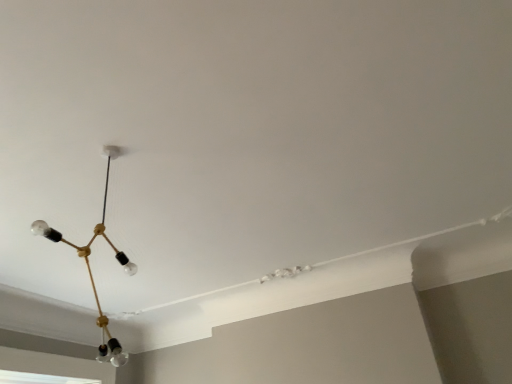
This screenshot has height=384, width=512. Describe the element at coordinates (90, 268) in the screenshot. I see `gold metallic chandelier at upper left` at that location.

At what (x,y) coordinates should I click in order to perform the action: click on gold metallic chandelier at upper left. Please return your answer as a coordinate pair (x, y). This screenshot has width=512, height=384. Looking at the image, I should click on 90,268.

What do you see at coordinates (40, 378) in the screenshot? The width and height of the screenshot is (512, 384). I see `transparent glass window at lower left` at bounding box center [40, 378].

You are a GUI agent. You are given a task and a screenshot of the screen. Output one action in this format:
    pyautogui.click(x=<x>, y=<y>)
    Task: Click on the transparent glass window at lower left
    
    Given the screenshot: What is the action you would take?
    coord(40,378)

Where is `gold metallic chandelier at upper left`? This screenshot has height=384, width=512. gold metallic chandelier at upper left is located at coordinates (90, 268).

Is transparent glass window at lower left to the left or to the right of gold metallic chandelier at upper left in the image?

In the image, transparent glass window at lower left appears on the left side of gold metallic chandelier at upper left.

Considering the positions of objects transparent glass window at lower left and gold metallic chandelier at upper left in the image provided, who is behind, transparent glass window at lower left or gold metallic chandelier at upper left?

transparent glass window at lower left is behind.

Which is closer, [81,383] or [83,252]?

The point [83,252] is in front.

From the image's perspective, is transparent glass window at lower left above or below gold metallic chandelier at upper left?

transparent glass window at lower left is below gold metallic chandelier at upper left.

From a real-world perspective, does transparent glass window at lower left stand above gold metallic chandelier at upper left?

No, from a real-world perspective, transparent glass window at lower left is not above gold metallic chandelier at upper left.

Looking at this image, looking at their sizes, would you say transparent glass window at lower left is wider or thinner than gold metallic chandelier at upper left?

Clearly, transparent glass window at lower left has less width compared to gold metallic chandelier at upper left.

Does transparent glass window at lower left have a greater height compared to gold metallic chandelier at upper left?

No, transparent glass window at lower left is not taller than gold metallic chandelier at upper left.

Which of these two, transparent glass window at lower left or gold metallic chandelier at upper left, is smaller?

With smaller size is transparent glass window at lower left.

Would you say transparent glass window at lower left contains gold metallic chandelier at upper left?

No, transparent glass window at lower left does not contain gold metallic chandelier at upper left.

Are transparent glass window at lower left and gold metallic chandelier at upper left far apart?

Yes, transparent glass window at lower left and gold metallic chandelier at upper left are located far from each other.

Is gold metallic chandelier at upper left at the back of transparent glass window at lower left?

No.

How many degrees apart are the facing directions of transparent glass window at lower left and gold metallic chandelier at upper left?

The angle between the facing direction of transparent glass window at lower left and the facing direction of gold metallic chandelier at upper left is 88.1 degrees.

You are a GUI agent. You are given a task and a screenshot of the screen. Output one action in this format:
    pyautogui.click(x=<x>, y=<y>)
    Task: Click on the lamp in front of the transparent glass window at lower left
    The height and width of the screenshot is (384, 512).
    Given the screenshot: What is the action you would take?
    pyautogui.click(x=90, y=268)

Between gold metallic chandelier at upper left and transparent glass window at lower left, which one appears on the left side from the viewer's perspective?

From the viewer's perspective, transparent glass window at lower left appears more on the left side.

Is gold metallic chandelier at upper left positioned before transparent glass window at lower left?

That is True.

Is point (134, 274) behind point (85, 378)?

No, it is not.

From the image's perspective, is gold metallic chandelier at upper left located above or below transparent glass window at lower left?

Based on their image positions, gold metallic chandelier at upper left is located above transparent glass window at lower left.

From a real-world perspective, who is located lower, gold metallic chandelier at upper left or transparent glass window at lower left?

transparent glass window at lower left, from a real-world perspective.

Is gold metallic chandelier at upper left thinner than transparent glass window at lower left?

No.

Can you confirm if gold metallic chandelier at upper left is shorter than transparent glass window at lower left?

Incorrect, the height of gold metallic chandelier at upper left does not fall short of that of transparent glass window at lower left.

Can you confirm if gold metallic chandelier at upper left is bigger than transparent glass window at lower left?

Yes.

Can transparent glass window at lower left be found inside gold metallic chandelier at upper left?

Definitely not — transparent glass window at lower left is not inside gold metallic chandelier at upper left.

Does gold metallic chandelier at upper left touch transparent glass window at lower left?

They are not placed beside each other.

Could you tell me if gold metallic chandelier at upper left is turned towards transparent glass window at lower left?

No.

You are a GUI agent. You are given a task and a screenshot of the screen. Output one action in this format:
    pyautogui.click(x=<x>, y=<y>)
    Task: Click on the window lying behind the gold metallic chandelier at upper left
    
    Given the screenshot: What is the action you would take?
    pyautogui.click(x=40, y=378)

Image resolution: width=512 pixels, height=384 pixels. I want to click on lamp positioned vertically above the transparent glass window at lower left (from a real-world perspective), so click(90, 268).

This screenshot has width=512, height=384. In order to click on lamp above the transparent glass window at lower left (from the image's perspective) in this screenshot , I will do `click(90, 268)`.